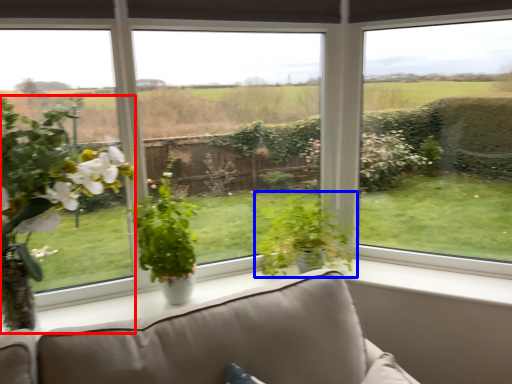
Question: Which object appears closest to the camera in this image, houseplant (highlighted by a red box) or houseplant (highlighted by a blue box)?

Choices:
 (A) houseplant
 (B) houseplant

Answer: (A)